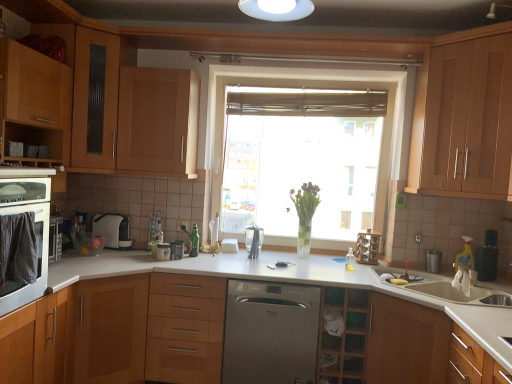
The height and width of the screenshot is (384, 512). In order to click on vacant area that is situated to the right of satin silver knife block at center, the 3th appliance when ordered from left to right in this screenshot , I will do `click(274, 260)`.